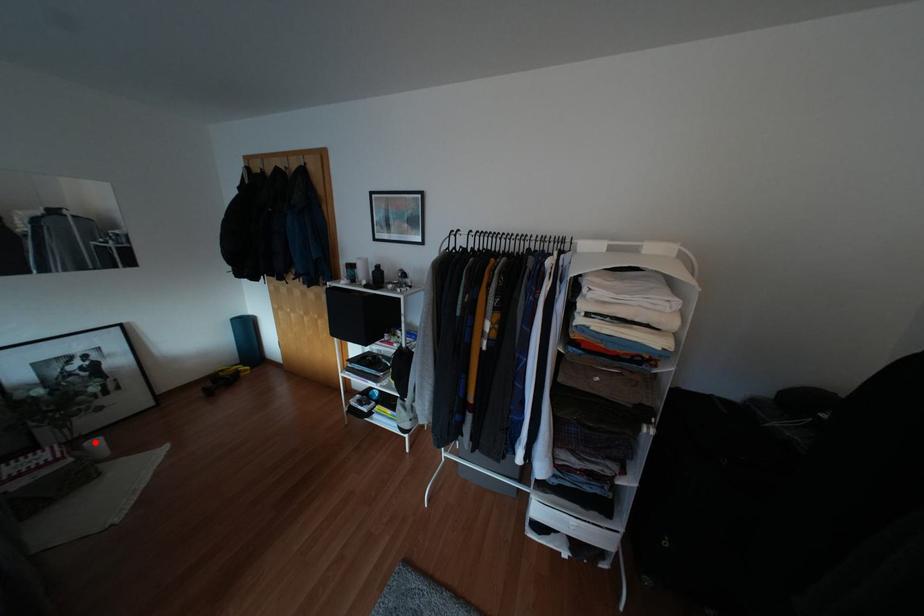
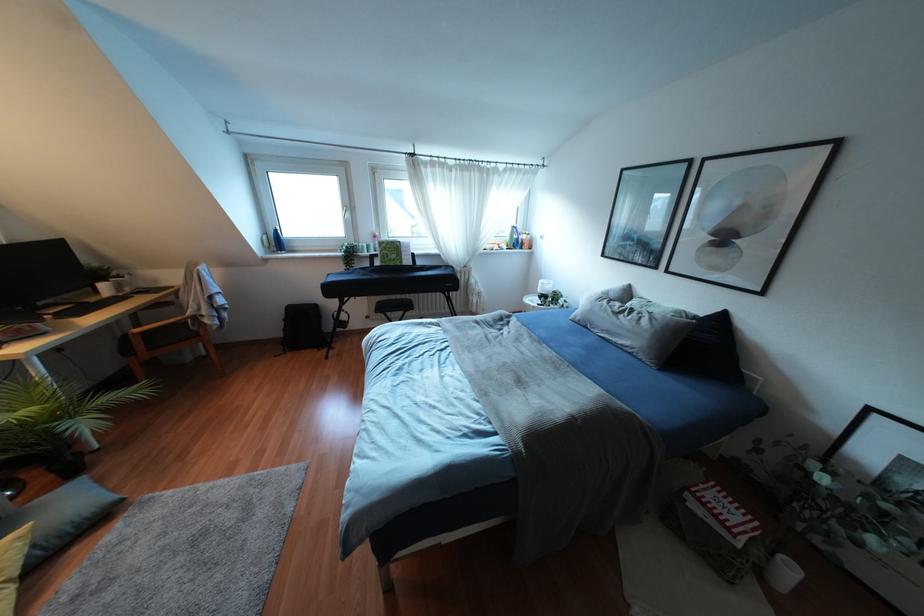
Question: I am providing you with two images of the same scene from different viewpoints. In image1, a red point is highlighted. Considering the same 3D point in image2, which of the following is correct?

Choices:
 (A) It is closer
 (B) It is farther

Answer: (A)